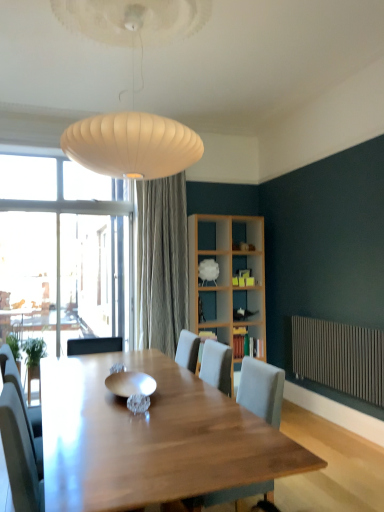
Question: Can you confirm if metallic radiator at lower right is bigger than light gray fabric chair at center?

Choices:
 (A) no
 (B) yes

Answer: (A)

Question: Is metallic radiator at lower right located outside light gray fabric chair at center?

Choices:
 (A) no
 (B) yes

Answer: (B)

Question: Does metallic radiator at lower right come in front of light gray fabric chair at center?

Choices:
 (A) no
 (B) yes

Answer: (A)

Question: Does metallic radiator at lower right have a greater height compared to light gray fabric chair at center?

Choices:
 (A) no
 (B) yes

Answer: (A)

Question: Is light gray fabric chair at center at the back of metallic radiator at lower right?

Choices:
 (A) no
 (B) yes

Answer: (A)

Question: Does metallic radiator at lower right have a greater width compared to light gray fabric chair at center?

Choices:
 (A) yes
 (B) no

Answer: (B)

Question: Considering the relative sizes of white fabric at upper center, marked as the 1th shelf in a top-to-bottom arrangement, and light gray fabric chair at center in the image provided, is white fabric at upper center, marked as the 1th shelf in a top-to-bottom arrangement, wider than light gray fabric chair at center?

Choices:
 (A) no
 (B) yes

Answer: (A)

Question: From a real-world perspective, is white fabric at upper center, marked as the 1th shelf in a top-to-bottom arrangement, physically above light gray fabric chair at center?

Choices:
 (A) yes
 (B) no

Answer: (A)

Question: Would you say white fabric at upper center, marked as the 1th shelf in a top-to-bottom arrangement, is outside light gray fabric chair at center?

Choices:
 (A) yes
 (B) no

Answer: (A)

Question: Is white fabric at upper center, marked as the 1th shelf in a top-to-bottom arrangement, not close to light gray fabric chair at center?

Choices:
 (A) yes
 (B) no

Answer: (A)

Question: Considering the relative positions of white fabric at upper center, marked as the 1th shelf in a top-to-bottom arrangement, and light gray fabric chair at center in the image provided, is white fabric at upper center, marked as the 1th shelf in a top-to-bottom arrangement, behind light gray fabric chair at center?

Choices:
 (A) no
 (B) yes

Answer: (B)

Question: From the image's perspective, is white fabric at upper center, marked as the 1th shelf in a top-to-bottom arrangement, over light gray fabric chair at center?

Choices:
 (A) yes
 (B) no

Answer: (A)

Question: Is wooden bookshelf at center, positioned as the 1th shelf in bottom-to-top order, positioned before wooden bookshelf at center, placed as the 2th shelf when sorted from top to bottom?

Choices:
 (A) yes
 (B) no

Answer: (B)